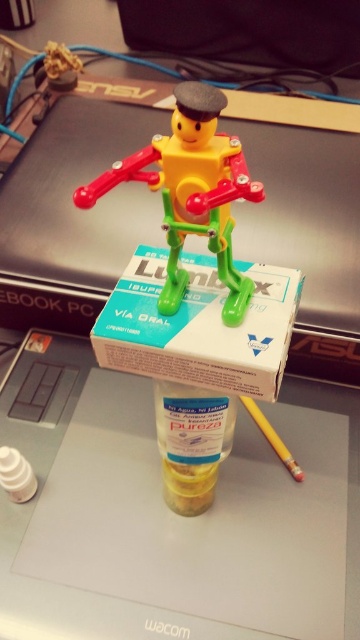
Who is more forward, (262, 291) or (205, 452)?

Positioned in front is point (262, 291).

Is green cardboard box at center behind translucent plastic bottle at center?

No, it is in front of translucent plastic bottle at center.

Find the location of `green cardboard box at center`. green cardboard box at center is located at coordinates (199, 326).

Locate an element on the screen. Image resolution: width=360 pixels, height=640 pixels. green cardboard box at center is located at coordinates (199, 326).

Is translucent plastic bottle at center positioned before yellow matte pencil at lower right?

Yes.

Is translucent plastic bottle at center bigger than yellow matte pencil at lower right?

Indeed, translucent plastic bottle at center has a larger size compared to yellow matte pencil at lower right.

Is point (169, 490) positioned behind point (281, 442)?

No, it is in front of (281, 442).

Where is `translucent plastic bottle at center`? The width and height of the screenshot is (360, 640). translucent plastic bottle at center is located at coordinates (191, 444).

Between point (155, 364) and point (266, 426), which one is positioned in front?

Point (155, 364) is more forward.

Is point (263, 324) behind point (268, 436)?

No.

Locate an element on the screen. The image size is (360, 640). green cardboard box at center is located at coordinates [199, 326].